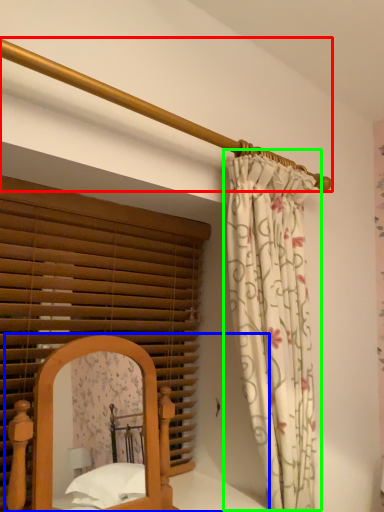
Question: Considering the real-world distances, which object is closest to balustrade (highlighted by a red box)? bed (highlighted by a blue box) or curtain (highlighted by a green box).

Choices:
 (A) bed
 (B) curtain

Answer: (B)